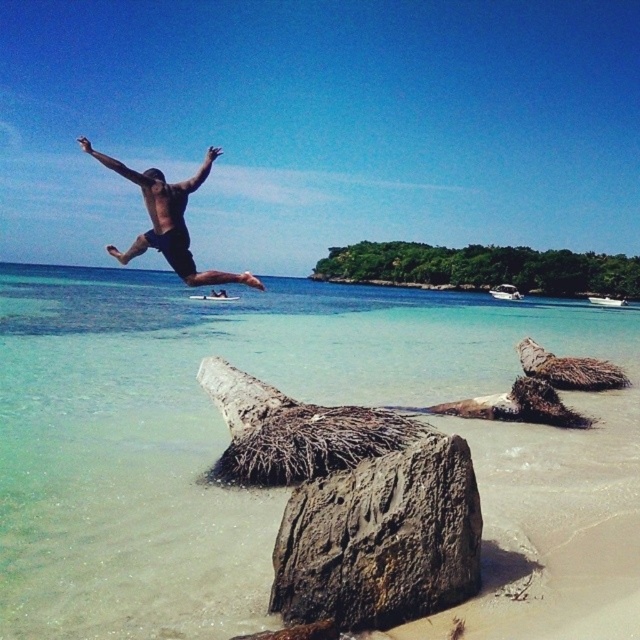
Based on the photo, which is more to the right, clear sand at lower center or rusty metallic rock at lower center?

clear sand at lower center is more to the right.

From the picture: Does clear sand at lower center appear on the left side of rusty metallic rock at lower center?

No, clear sand at lower center is not to the left of rusty metallic rock at lower center.

Who is more forward, (109, 312) or (420, 513)?

Point (420, 513) is more forward.

This screenshot has width=640, height=640. In order to click on clear sand at lower center in this screenshot , I will do `click(227, 436)`.

Which is above, rusty metallic rock at lower center or matte black shorts at upper center?

matte black shorts at upper center is above.

Does rusty metallic rock at lower center come in front of matte black shorts at upper center?

Yes, it is in front of matte black shorts at upper center.

Is point (458, 502) positioned after point (161, 244)?

No.

Locate an element on the screen. The height and width of the screenshot is (640, 640). rusty metallic rock at lower center is located at coordinates (380, 540).

Is clear sand at lower center bigger than matte black shorts at upper center?

No, clear sand at lower center is not bigger than matte black shorts at upper center.

Describe the element at coordinates (227, 436) in the screenshot. This screenshot has width=640, height=640. I see `clear sand at lower center` at that location.

Locate an element on the screen. The height and width of the screenshot is (640, 640). clear sand at lower center is located at coordinates (227, 436).